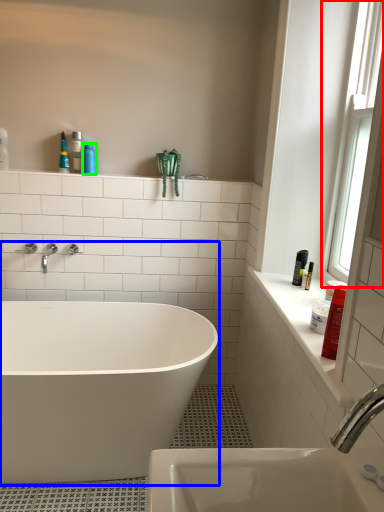
Question: Which object is the closest to the window (highlighted by a red box)? Choose among these: bathtub (highlighted by a blue box) or toiletry (highlighted by a green box).

Choices:
 (A) bathtub
 (B) toiletry

Answer: (A)